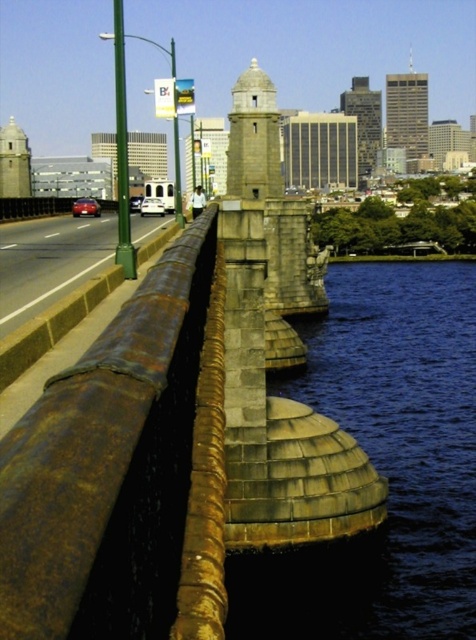
Does rusty metal rail at center-left appear on the left side of rustic stone bell tower at center?

Result: Correct, you'll find rusty metal rail at center-left to the left of rustic stone bell tower at center.

Is point (90, 552) positioned in front of point (239, 150)?

Yes, point (90, 552) is closer to viewer.

Measure the distance between rusty metal rail at center-left and camera.

A distance of 35.48 feet exists between rusty metal rail at center-left and camera.

The height and width of the screenshot is (640, 476). Identify the location of rusty metal rail at center-left. (109, 467).

Does rustic stone bell tower at center have a smaller size compared to gold textured skyscraper at upper center?

Correct, rustic stone bell tower at center occupies less space than gold textured skyscraper at upper center.

Is point (268, 129) positioned before point (404, 147)?

Yes.

Where is `rustic stone bell tower at center`? The height and width of the screenshot is (640, 476). rustic stone bell tower at center is located at coordinates (254, 138).

The image size is (476, 640). I want to click on gold textured skyscraper at upper center, so click(407, 113).

Is gold textured skyscraper at upper center taller than rustic stone tower at upper center?

No, gold textured skyscraper at upper center is not taller than rustic stone tower at upper center.

The width and height of the screenshot is (476, 640). I want to click on gold textured skyscraper at upper center, so click(407, 113).